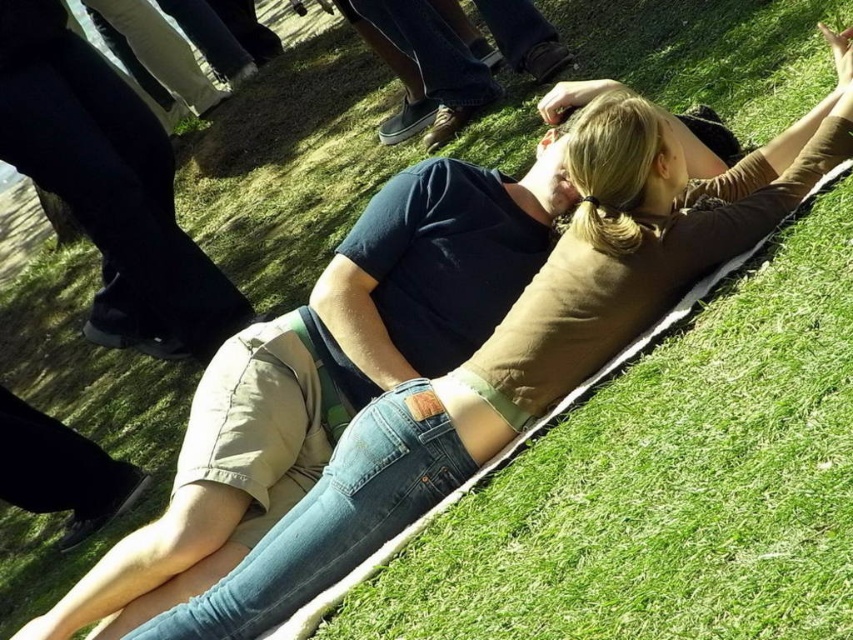
You are a photographer planning to take a photo of the two people lying on the grass. The point marked as point (109, 186) indicates the location of black matte pants at lower left. Where should you position yourself to ensure both the black matte pants at lower left and the other person are fully visible in the frame?

Position yourself so that you can see both the black matte pants at lower left and the other person. Since the black matte pants at lower left are at the lower left, you should position yourself at a higher angle, possibly standing, to capture the entire scene including the lower left area where the black matte pants at lower left are located and the other person.

You are a photographer standing at the lower left corner of the image. You want to take a photo of the black matte pants at lower left and ensure that the person on the right wearing a brown long sleeve top and blue jeans is also in the frame. Given that your camera has a 60 degree field of view, can you capture both subjects without moving? Explain your reasoning.

The black matte pants at lower left and the person on the right wearing a brown long sleeve top and blue jeans are 5.43 meters apart. With a 60 degree field of view, the camera can capture objects up to approximately 5.43 meters apart within its frame. Therefore, it is possible to include both subjects in the photo without moving.

You are standing in a park and see two points marked on the ground. The first point is at coordinate point [24,93] and the second is at point [425,8]. If you want to reach the point closer to you first, which coordinate should you go to first?

You should go to point [24,93] first because it is closer to the viewer than point [425,8].